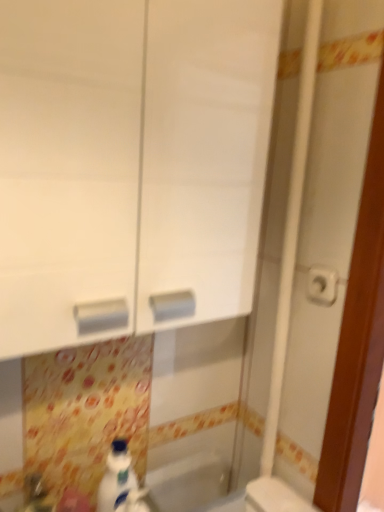
Question: Considering the relative sizes of white glossy bottle at lower center and white glossy cabinet at center in the image provided, is white glossy bottle at lower center smaller than white glossy cabinet at center?

Choices:
 (A) yes
 (B) no

Answer: (A)

Question: Is white glossy cabinet at center at the back of white glossy bottle at lower center?

Choices:
 (A) no
 (B) yes

Answer: (A)

Question: From a real-world perspective, is white glossy bottle at lower center on top of white glossy cabinet at center?

Choices:
 (A) no
 (B) yes

Answer: (A)

Question: Can you confirm if white glossy bottle at lower center is positioned to the right of white glossy cabinet at center?

Choices:
 (A) yes
 (B) no

Answer: (B)

Question: Is white glossy bottle at lower center wider than white glossy cabinet at center?

Choices:
 (A) no
 (B) yes

Answer: (A)

Question: Considering the positions of white plastic toilet paper at right and white glossy bottle at lower center in the image, is white plastic toilet paper at right taller or shorter than white glossy bottle at lower center?

Choices:
 (A) tall
 (B) short

Answer: (B)

Question: Is white plastic toilet paper at right to the left or to the right of white glossy bottle at lower center in the image?

Choices:
 (A) right
 (B) left

Answer: (A)

Question: Is white plastic toilet paper at right bigger or smaller than white glossy bottle at lower center?

Choices:
 (A) big
 (B) small

Answer: (B)

Question: In terms of width, does white plastic toilet paper at right look wider or thinner when compared to white glossy bottle at lower center?

Choices:
 (A) wide
 (B) thin

Answer: (B)

Question: From the image's perspective, relative to white glossy sink at lower left, is white glossy cabinet at center above or below?

Choices:
 (A) above
 (B) below

Answer: (A)

Question: Considering the positions of white glossy cabinet at center and white glossy sink at lower left in the image, is white glossy cabinet at center taller or shorter than white glossy sink at lower left?

Choices:
 (A) short
 (B) tall

Answer: (B)

Question: Looking at their shapes, would you say white glossy cabinet at center is wider or thinner than white glossy sink at lower left?

Choices:
 (A) wide
 (B) thin

Answer: (A)

Question: From a real-world perspective, is white glossy cabinet at center physically located above or below white glossy sink at lower left?

Choices:
 (A) below
 (B) above

Answer: (B)

Question: From their relative heights in the image, would you say white plastic toilet paper at right is taller or shorter than white plastic toilet at lower right?

Choices:
 (A) short
 (B) tall

Answer: (A)

Question: From a real-world perspective, is white plastic toilet paper at right above or below white plastic toilet at lower right?

Choices:
 (A) below
 (B) above

Answer: (B)